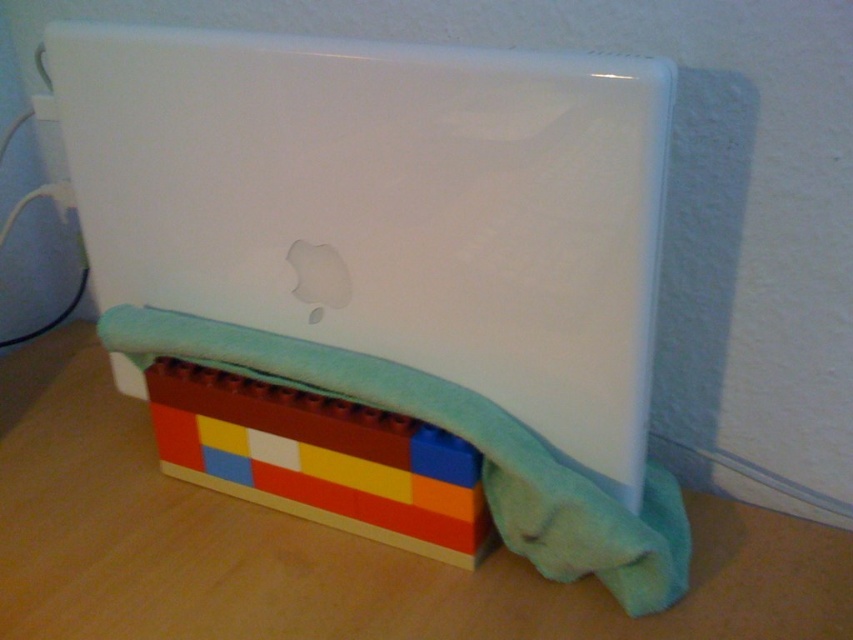
You are organizing a small display on a desk and have a white glossy laptop at center and multicolored plastic blocks at lower center. Which object takes up more space on the desk?

The white glossy laptop at center is bigger than the multicolored plastic blocks at lower center, so it takes up more space on the desk.

You are a delivery person who needs to place a small package on the desk where the white glossy laptop at center is located. The package requires 20 centimeters of space in front of the laptop. Is there enough space available?

The white glossy laptop at center is 58.40 centimeters away from the viewer. Since the package only needs 20 centimeters of space in front of the laptop, there is sufficient space available.